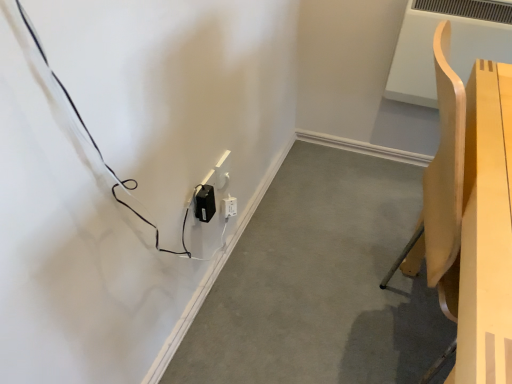
In order to face black plastic power adapter at lower center, the 1th electric outlet when ordered from front to back, should I rotate leftwards or rightwards?

Rotate your view left by about 6.552°.

Measure the distance between point [223,165] and camera.

Point [223,165] and camera are 4.12 feet apart.

Describe the element at coordinates (222, 170) in the screenshot. I see `white plastic electric outlet at center, arranged as the 2th electric outlet when viewed from the front` at that location.

At what (x,y) coordinates should I click in order to perform the action: click on black plastic power adapter at lower left. Please return your answer as a coordinate pair (x, y). Looking at the image, I should click on (320, 283).

Is black plastic power adapter at lower left at the back of white plastic electric outlet at center, which is the 1th electric outlet in back-to-front order?

No, white plastic electric outlet at center, which is the 1th electric outlet in back-to-front order, is not facing the opposite direction of black plastic power adapter at lower left.

Which of these two, white plastic electric outlet at center, arranged as the 2th electric outlet when viewed from the front, or black plastic power adapter at lower left, is bigger?

Bigger between the two is black plastic power adapter at lower left.

Is white plastic electric outlet at center, which is the 1th electric outlet in back-to-front order, not near black plastic power adapter at lower left?

No, white plastic electric outlet at center, which is the 1th electric outlet in back-to-front order, is not far away from black plastic power adapter at lower left.

Who is shorter, white plastic electric outlet at center, arranged as the 2th electric outlet when viewed from the front, or black plastic power adapter at lower left?

With less height is black plastic power adapter at lower left.

From the image's perspective, is light wood chair at right under white plastic electric outlet at center, which is the 1th electric outlet in back-to-front order?

Correct, light wood chair at right appears lower than white plastic electric outlet at center, which is the 1th electric outlet in back-to-front order, in the image.

From the picture: Is light wood chair at right taller than white plastic electric outlet at center, arranged as the 2th electric outlet when viewed from the front?

Indeed, light wood chair at right has a greater height compared to white plastic electric outlet at center, arranged as the 2th electric outlet when viewed from the front.

Is light wood chair at right aimed at white plastic electric outlet at center, arranged as the 2th electric outlet when viewed from the front?

No.

Would you say light wood chair at right is inside or outside white plastic electric outlet at center, which is the 1th electric outlet in back-to-front order?

light wood chair at right lies outside white plastic electric outlet at center, which is the 1th electric outlet in back-to-front order.

Considering the relative sizes of black plastic power adapter at lower left and black plastic power adapter at lower center, the 1th electric outlet when ordered from front to back, in the image provided, is black plastic power adapter at lower left thinner than black plastic power adapter at lower center, the 1th electric outlet when ordered from front to back,?

No.

Visually, is black plastic power adapter at lower left positioned to the left or to the right of black plastic power adapter at lower center, the 1th electric outlet when ordered from front to back?

From the image, it's evident that black plastic power adapter at lower left is to the right of black plastic power adapter at lower center, the 1th electric outlet when ordered from front to back.

Would you say black plastic power adapter at lower center, the second electric outlet when ordered from back to front, is part of black plastic power adapter at lower left's contents?

A: Definitely not — black plastic power adapter at lower center, the second electric outlet when ordered from back to front, is not inside black plastic power adapter at lower left.

Measure the distance between black plastic power adapter at lower left and black plastic power adapter at lower center, the second electric outlet when ordered from back to front.

black plastic power adapter at lower left is 22.21 inches from black plastic power adapter at lower center, the second electric outlet when ordered from back to front.

Consider the image. Would you say black plastic power adapter at lower center, the 1th electric outlet when ordered from front to back, is outside white plastic electric outlet at center, arranged as the 2th electric outlet when viewed from the front?

Absolutely, black plastic power adapter at lower center, the 1th electric outlet when ordered from front to back, is external to white plastic electric outlet at center, arranged as the 2th electric outlet when viewed from the front.

Can you tell me how much black plastic power adapter at lower center, the second electric outlet when ordered from back to front, and white plastic electric outlet at center, which is the 1th electric outlet in back-to-front order, differ in facing direction?

2.96 degrees separate the facing orientations of black plastic power adapter at lower center, the second electric outlet when ordered from back to front, and white plastic electric outlet at center, which is the 1th electric outlet in back-to-front order.

From the image's perspective, is black plastic power adapter at lower center, the 1th electric outlet when ordered from front to back, above white plastic electric outlet at center, arranged as the 2th electric outlet when viewed from the front?

No, from the image's perspective, black plastic power adapter at lower center, the 1th electric outlet when ordered from front to back, is not over white plastic electric outlet at center, arranged as the 2th electric outlet when viewed from the front.

Which of these two, black plastic power adapter at lower center, the 1th electric outlet when ordered from front to back, or white plastic electric outlet at center, which is the 1th electric outlet in back-to-front order, stands taller?

Standing taller between the two is white plastic electric outlet at center, which is the 1th electric outlet in back-to-front order.

From a real-world perspective, is black plastic power adapter at lower center, the second electric outlet when ordered from back to front, above or below black plastic power adapter at lower left?

From a real-world perspective, black plastic power adapter at lower center, the second electric outlet when ordered from back to front, is physically above black plastic power adapter at lower left.

From the picture: Who is shorter, black plastic power adapter at lower center, the 1th electric outlet when ordered from front to back, or black plastic power adapter at lower left?

With less height is black plastic power adapter at lower left.

Can you confirm if black plastic power adapter at lower center, the 1th electric outlet when ordered from front to back, is bigger than black plastic power adapter at lower left?

Actually, black plastic power adapter at lower center, the 1th electric outlet when ordered from front to back, might be smaller than black plastic power adapter at lower left.

From the picture: Which is more to the right, black plastic power adapter at lower center, the second electric outlet when ordered from back to front, or black plastic power adapter at lower left?

black plastic power adapter at lower left.

From a real-world perspective, which is physically below, light wood chair at right or black plastic power adapter at lower center, the second electric outlet when ordered from back to front?

black plastic power adapter at lower center, the second electric outlet when ordered from back to front, from a real-world perspective.

Is light wood chair at right not within black plastic power adapter at lower center, the 1th electric outlet when ordered from front to back?

Yes, light wood chair at right is outside of black plastic power adapter at lower center, the 1th electric outlet when ordered from front to back.

Is light wood chair at right bigger than black plastic power adapter at lower center, the 1th electric outlet when ordered from front to back?

Correct, light wood chair at right is larger in size than black plastic power adapter at lower center, the 1th electric outlet when ordered from front to back.

Is light wood chair at right next to black plastic power adapter at lower center, the second electric outlet when ordered from back to front, and touching it?

They are not placed beside each other.

In the scene shown: Is light wood chair at right placed right next to black plastic power adapter at lower left?

light wood chair at right is not next to black plastic power adapter at lower left, and they're not touching.

Considering the relative sizes of light wood chair at right and black plastic power adapter at lower left in the image provided, is light wood chair at right thinner than black plastic power adapter at lower left?

Yes, light wood chair at right is thinner than black plastic power adapter at lower left.

From a real-world perspective, which object rests below the other?

black plastic power adapter at lower left is physically lower.

Could you tell me if light wood chair at right is turned towards black plastic power adapter at lower left?

No, light wood chair at right is not turned towards black plastic power adapter at lower left.

Where is `concrete located underneath the white plastic electric outlet at center, which is the 1th electric outlet in back-to-front order (from a real-world perspective)`? concrete located underneath the white plastic electric outlet at center, which is the 1th electric outlet in back-to-front order (from a real-world perspective) is located at coordinates (320, 283).

Where is `furniture in front of the white plastic electric outlet at center, which is the 1th electric outlet in back-to-front order`? This screenshot has height=384, width=512. furniture in front of the white plastic electric outlet at center, which is the 1th electric outlet in back-to-front order is located at coordinates (469, 215).

Based on their spatial positions, is white plastic electric outlet at center, which is the 1th electric outlet in back-to-front order, or black plastic power adapter at lower center, the second electric outlet when ordered from back to front, closer to black plastic power adapter at lower left?

Among the two, white plastic electric outlet at center, which is the 1th electric outlet in back-to-front order, is located nearer to black plastic power adapter at lower left.

From the picture: When comparing their distances from light wood chair at right, does white plastic electric outlet at center, which is the 1th electric outlet in back-to-front order, or black plastic power adapter at lower center, the 1th electric outlet when ordered from front to back, seem further?

Among the two, white plastic electric outlet at center, which is the 1th electric outlet in back-to-front order, is located further to light wood chair at right.

Looking at the image, which one is located closer to black plastic power adapter at lower left, black plastic power adapter at lower center, the 1th electric outlet when ordered from front to back, or white plastic electric outlet at center, arranged as the 2th electric outlet when viewed from the front?

The object closer to black plastic power adapter at lower left is white plastic electric outlet at center, arranged as the 2th electric outlet when viewed from the front.

From the image, which object appears to be farther from white plastic electric outlet at center, which is the 1th electric outlet in back-to-front order, light wood chair at right or black plastic power adapter at lower left?

The object further to white plastic electric outlet at center, which is the 1th electric outlet in back-to-front order, is light wood chair at right.

When comparing their distances from black plastic power adapter at lower center, the 1th electric outlet when ordered from front to back, does white plastic electric outlet at center, arranged as the 2th electric outlet when viewed from the front, or black plastic power adapter at lower left seem further?

black plastic power adapter at lower left.

Estimate the real-world distances between objects in this image. Which object is closer to light wood chair at right, black plastic power adapter at lower left or black plastic power adapter at lower center, the 1th electric outlet when ordered from front to back?

black plastic power adapter at lower left lies closer to light wood chair at right than the other object.

Looking at the image, which one is located closer to light wood chair at right, white plastic electric outlet at center, which is the 1th electric outlet in back-to-front order, or black plastic power adapter at lower left?

Based on the image, black plastic power adapter at lower left appears to be nearer to light wood chair at right.

When comparing their distances from black plastic power adapter at lower center, the second electric outlet when ordered from back to front, does white plastic electric outlet at center, arranged as the 2th electric outlet when viewed from the front, or light wood chair at right seem closer?

The object closer to black plastic power adapter at lower center, the second electric outlet when ordered from back to front, is white plastic electric outlet at center, arranged as the 2th electric outlet when viewed from the front.

At what (x,y) coordinates should I click in order to perform the action: click on electric outlet between black plastic power adapter at lower center, the second electric outlet when ordered from back to front, and black plastic power adapter at lower left. Please return your answer as a coordinate pair (x, y). The image size is (512, 384). Looking at the image, I should click on (222, 170).

Image resolution: width=512 pixels, height=384 pixels. What are the coordinates of `concrete located between light wood chair at right and white plastic electric outlet at center, which is the 1th electric outlet in back-to-front order, in the depth direction` in the screenshot? It's located at (320, 283).

I want to click on electric outlet between light wood chair at right and white plastic electric outlet at center, arranged as the 2th electric outlet when viewed from the front, from front to back, so click(205, 203).

You are a GUI agent. You are given a task and a screenshot of the screen. Output one action in this format:
    pyautogui.click(x=<x>, y=<y>)
    Task: Click on the concrete between light wood chair at right and black plastic power adapter at lower center, the second electric outlet when ordered from back to front, from front to back
    The image size is (512, 384).
    Given the screenshot: What is the action you would take?
    pyautogui.click(x=320, y=283)